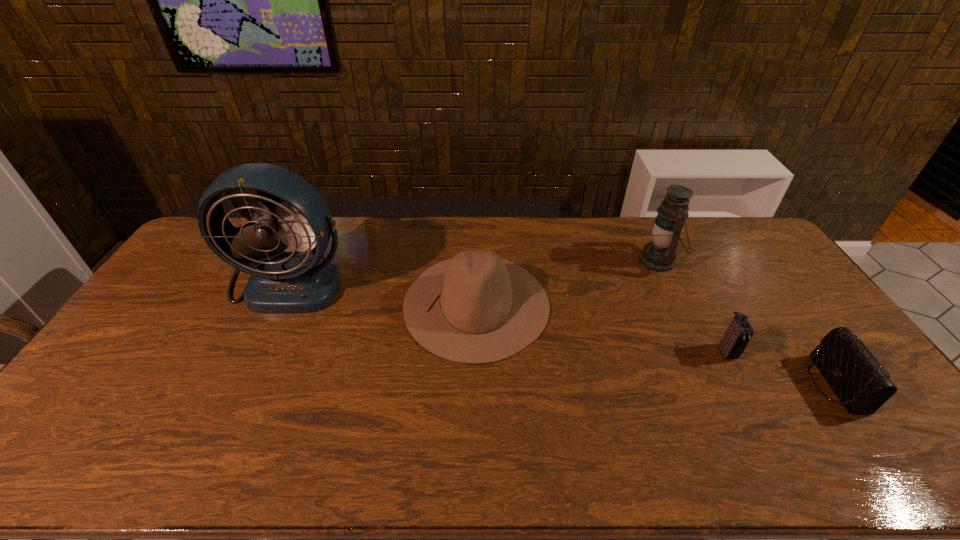
Locate an element on the screen. The width and height of the screenshot is (960, 540). blank area located 0.160m with the zip open on the left clutch bag is located at coordinates (759, 415).

This screenshot has height=540, width=960. Find the location of `vacant position located on the front flap of the rightmost object`. vacant position located on the front flap of the rightmost object is located at coordinates (752, 383).

Where is `blank space located on the front flap of the rightmost object`? The width and height of the screenshot is (960, 540). blank space located on the front flap of the rightmost object is located at coordinates (684, 383).

Locate an element on the screen. vacant space positioned 0.390m on the front flap of the rightmost object is located at coordinates (666, 383).

Locate an element on the screen. The image size is (960, 540). fan that is at the far edge is located at coordinates (288, 211).

Where is `oil lamp situated at the far edge`? oil lamp situated at the far edge is located at coordinates (659, 255).

Where is `object that is positioned at the right edge`? object that is positioned at the right edge is located at coordinates (861, 385).

Identify the location of free space at the far edge of the desktop. (372, 226).

You are a GUI agent. You are given a task and a screenshot of the screen. Output one action in this format:
    pyautogui.click(x=<x>, y=<y>)
    Task: Click on the free space at the near edge
    The width and height of the screenshot is (960, 540).
    Given the screenshot: What is the action you would take?
    pyautogui.click(x=130, y=461)

In the image, there is a desktop. Where is `vacant space at the left edge`? vacant space at the left edge is located at coordinates (160, 362).